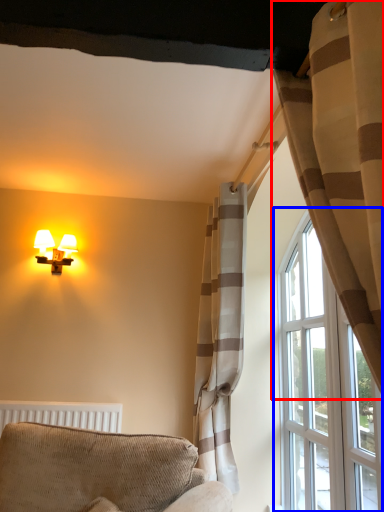
Question: Among these objects, which one is nearest to the camera, curtain (highlighted by a red box) or window (highlighted by a blue box)?

Choices:
 (A) curtain
 (B) window

Answer: (A)